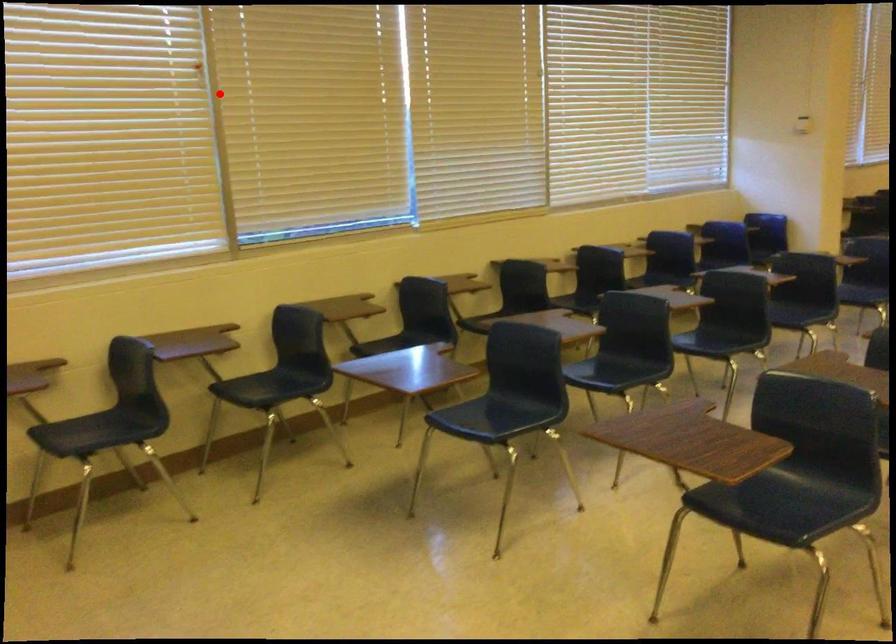
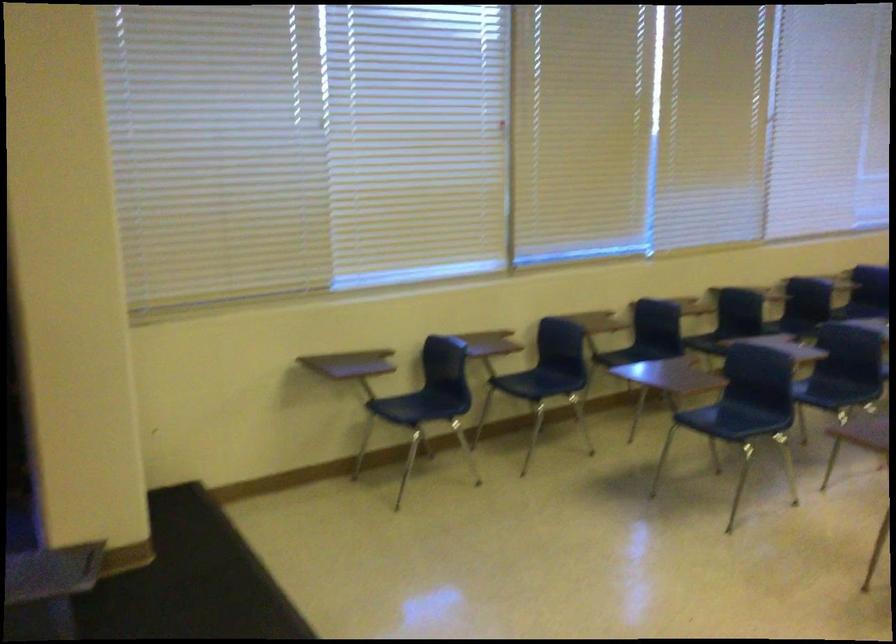
Question: I am providing you with two images of the same scene from different viewpoints. Image1 has a red point marked. In image2, the corresponding 3D location appears at what relative position? Reply with the corresponding letter.

Choices:
 (A) Closer
 (B) Farther

Answer: (B)